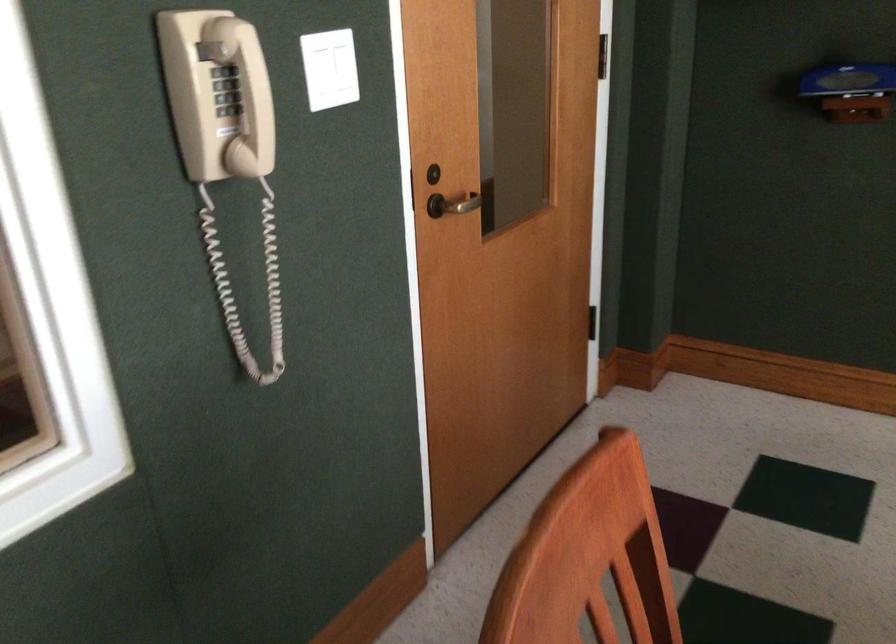
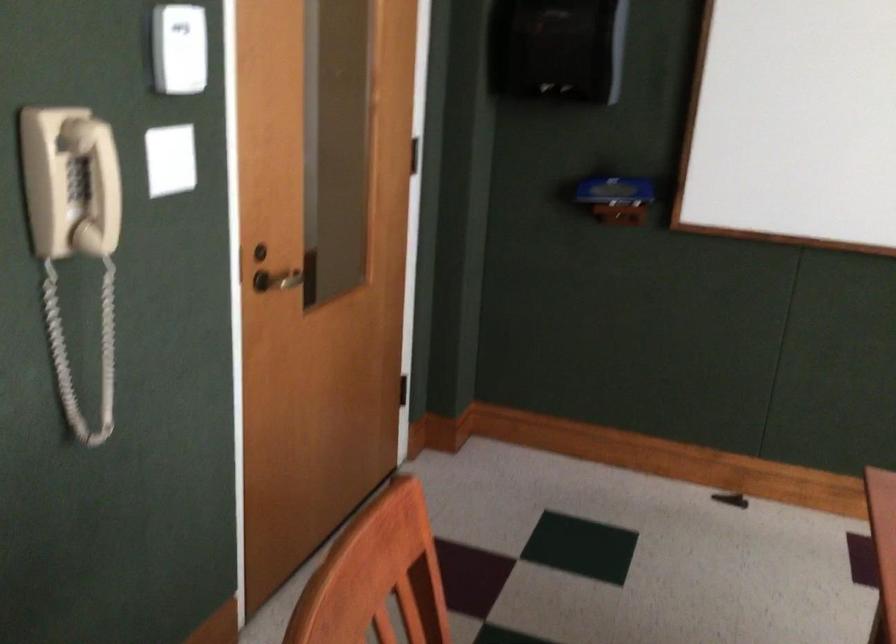
Question: Based on the continuous images, in which direction is the camera rotating? Reply with the corresponding letter.

Choices:
 (A) Left
 (B) Right
 (C) Up
 (D) Down

Answer: (B)